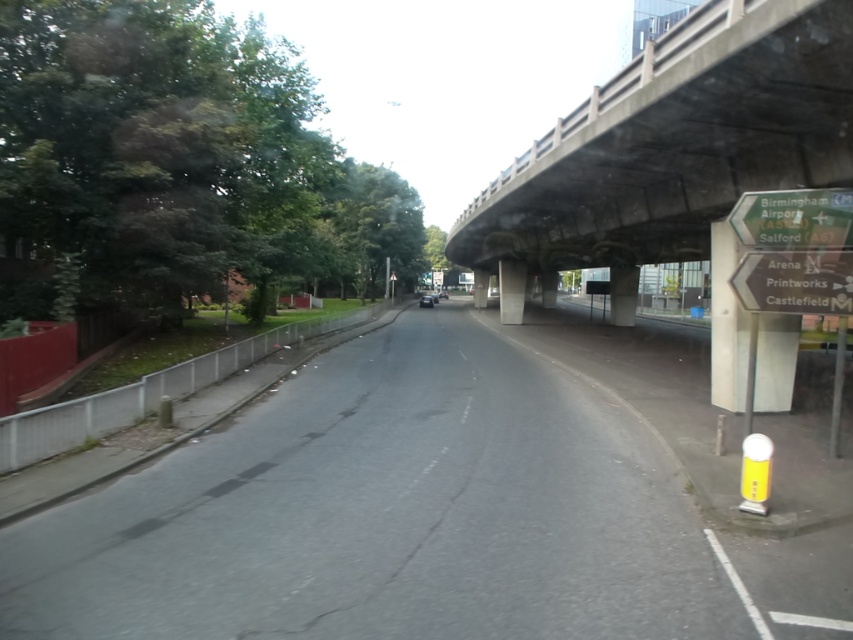
Consider the image. You are driving a car and want to know if there is enough space between the asphalt road at center and the concrete at upper center to safely make a U turn. The car requires a minimum of 15 meters to turn around. Can you safely make the U turn?

The distance between the asphalt road at center and the concrete at upper center is 15.66 meters, which is more than the required 15 meters. Therefore, you can safely make the U turn.

You are driving a car and want to know if the asphalt road at center is closer to you than the concrete at upper center. Based on the scene description, can you determine this?

Yes, the asphalt road at center is in front of the concrete at upper center, so it is closer to you.

You are driving and see the asphalt road at center and the green plastic sign at upper right. Which object is positioned to the left of the other?

The asphalt road at center is to the left of the green plastic sign at upper right.